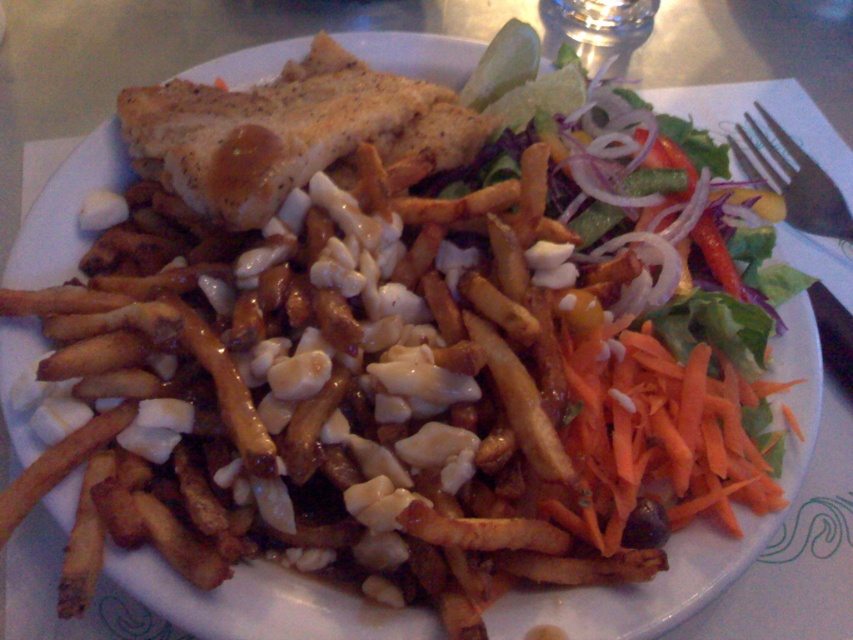
Question: Does orange shredded carrot at right come in front of black plastic fork at upper right?

Choices:
 (A) yes
 (B) no

Answer: (A)

Question: Does orange shredded carrot at right appear on the left side of black plastic fork at upper right?

Choices:
 (A) no
 (B) yes

Answer: (B)

Question: Does orange shredded carrot at right lie in front of black plastic fork at upper right?

Choices:
 (A) no
 (B) yes

Answer: (B)

Question: Which object appears farthest from the camera in this image?

Choices:
 (A) black plastic fork at upper right
 (B) orange shredded carrot at right

Answer: (A)